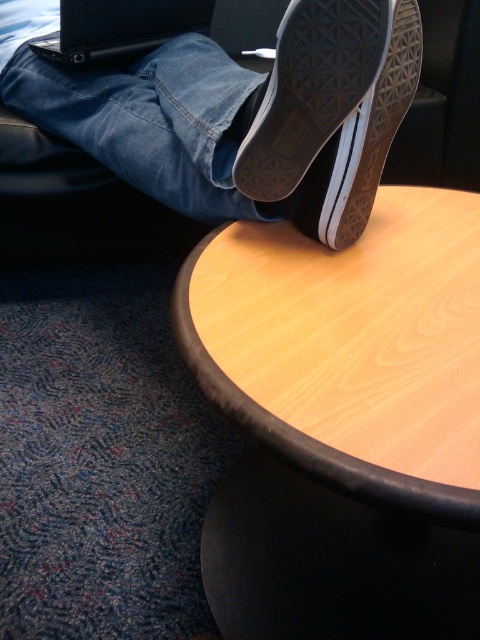
Between white canvas shoe at upper center and black matte laptop at upper left, which one has more height?

white canvas shoe at upper center is taller.

Between white canvas shoe at upper center and black matte laptop at upper left, which one has less height?

With less height is black matte laptop at upper left.

What do you see at coordinates (245, 115) in the screenshot? I see `white canvas shoe at upper center` at bounding box center [245, 115].

I want to click on white canvas shoe at upper center, so click(x=245, y=115).

Does black canvas shoe at upper center lie behind black matte laptop at upper left?

No, black canvas shoe at upper center is closer to the viewer.

Does black canvas shoe at upper center have a smaller size compared to black matte laptop at upper left?

Yes, black canvas shoe at upper center is smaller than black matte laptop at upper left.

Does point (331, 70) come behind point (127, 17)?

No, (331, 70) is in front of (127, 17).

In order to click on black canvas shoe at upper center in this screenshot , I will do `click(310, 90)`.

Is wooden table at upper center thinner than black canvas shoe at upper center?

In fact, wooden table at upper center might be wider than black canvas shoe at upper center.

Can you confirm if wooden table at upper center is positioned above black canvas shoe at upper center?

Incorrect, wooden table at upper center is not positioned above black canvas shoe at upper center.

Find the location of a particular element. wooden table at upper center is located at coordinates (349, 346).